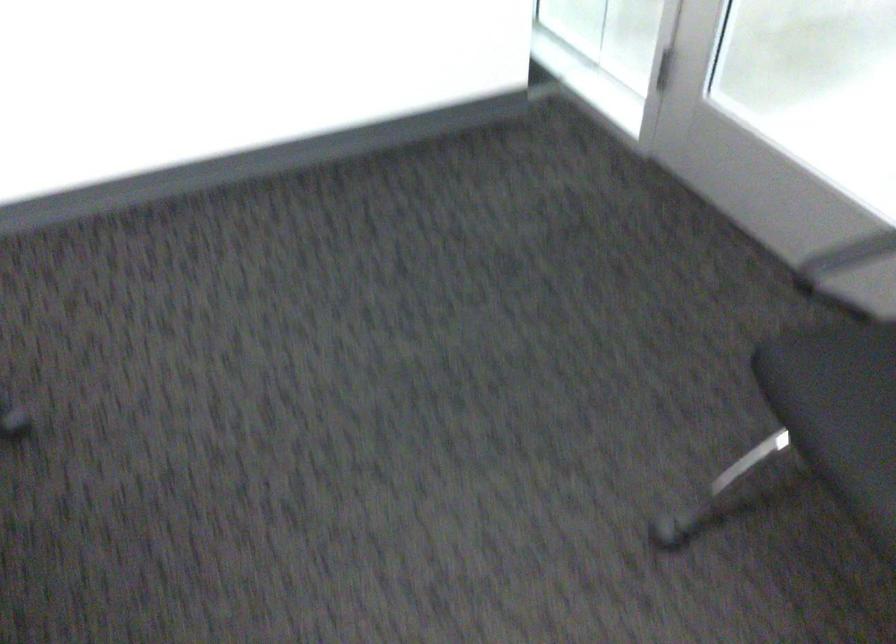
The first image is from the beginning of the video and the second image is from the end. How did the camera likely rotate when shooting the video?

The camera rotated toward right-down.